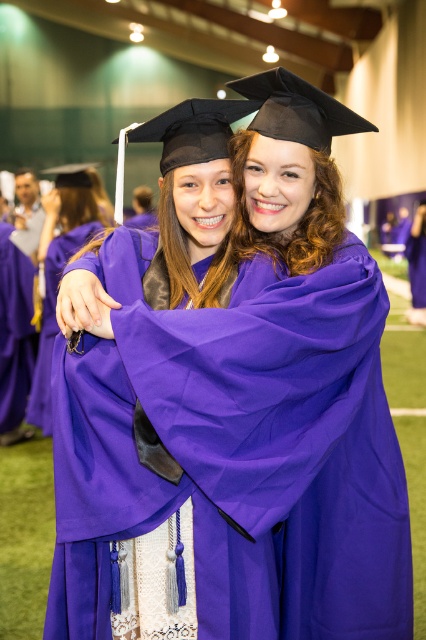
You are a photographer positioned at the entrance of the gym. You need to capture a photo of the matte purple gown at center. Based on its coordinates, in which direction should you aim your camera relative to your current position?

The matte purple gown at center is located at point 0.425 on the x and 0.138 on the y. Since the coordinate system starts at the bottom left corner, aiming slightly to the right and up from your current position at the entrance would capture the gown.

You are a photographer at the graduation ceremony. You need to capture a photo of both the matte purple gown at center and the purple matte graduation robe at center. Which one is positioned to the right of the other?

The matte purple gown at center is to the right of the purple matte graduation robe at center.